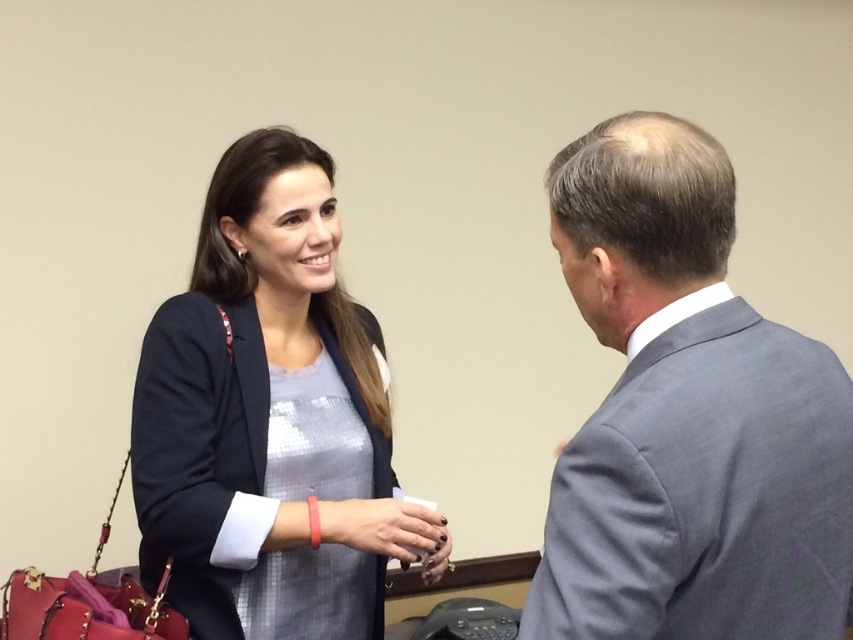
Question: Which point is closer to the camera taking this photo?

Choices:
 (A) (439, 573)
 (B) (675, 154)
 (C) (285, 337)

Answer: (B)

Question: Can you confirm if satin blue blazer at center is positioned to the right of matte black hand at center?

Choices:
 (A) yes
 (B) no

Answer: (B)

Question: Among these objects, which one is nearest to the camera?

Choices:
 (A) gray wool suit at right
 (B) matte black hand at center
 (C) satin blue blazer at center

Answer: (A)

Question: Among these objects, which one is nearest to the camera?

Choices:
 (A) satin blue blazer at center
 (B) gray wool suit at right

Answer: (B)

Question: Can you confirm if gray wool suit at right is smaller than satin blue blazer at center?

Choices:
 (A) yes
 (B) no

Answer: (A)

Question: Does gray wool suit at right have a greater width compared to satin blue blazer at center?

Choices:
 (A) no
 (B) yes

Answer: (A)